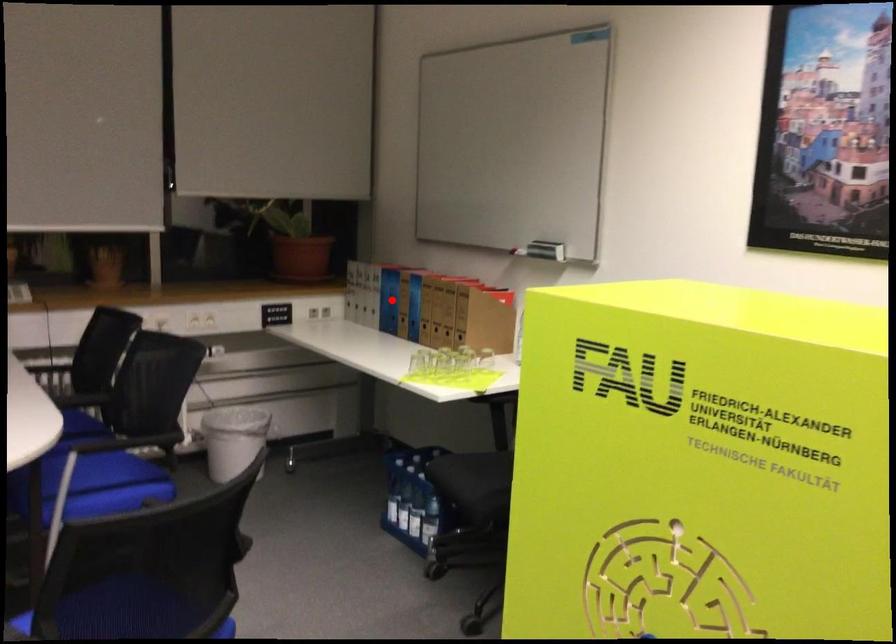
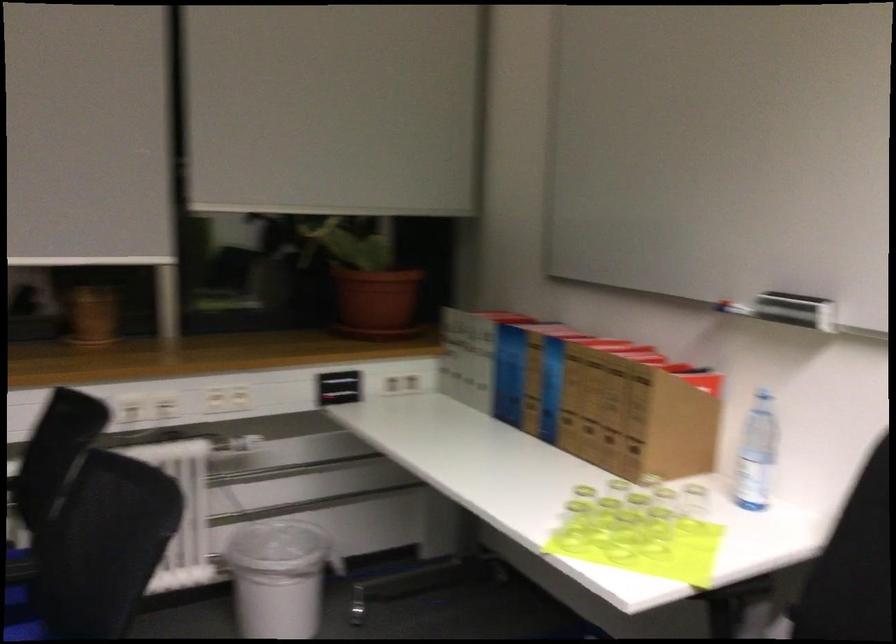
Question: I am providing you with two images of the same scene from different viewpoints. A red point is shown in image1. For the corresponding object point in image2, is it positioned nearer or farther from the camera?

Choices:
 (A) Nearer
 (B) Farther

Answer: (A)